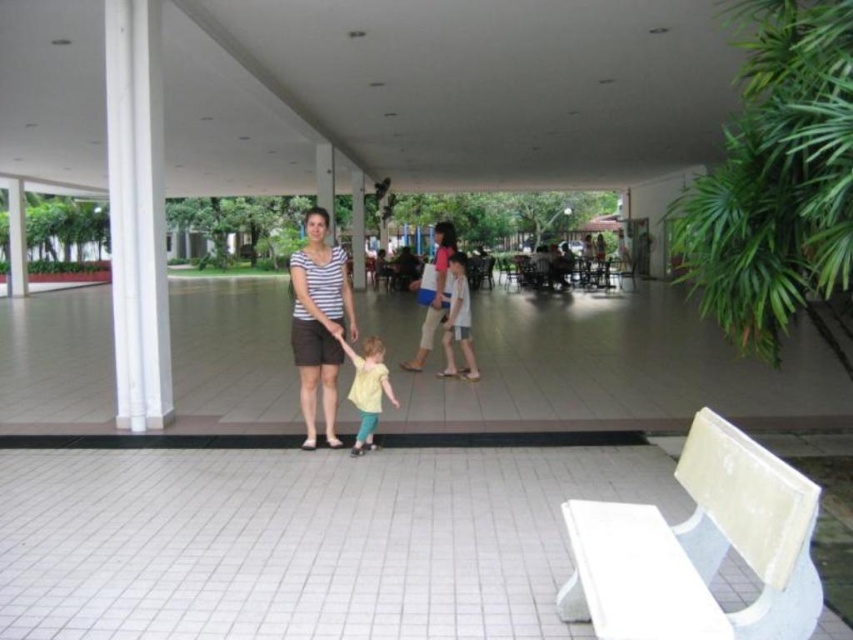
You are a photographer setting up for an event in the described area. You need to ensure that the yellow matte shirt at center and the light blue denim shorts at center are both visible in your shot. Given their sizes, which object should you focus on first to ensure proper framing?

The yellow matte shirt at center is smaller than the light blue denim shorts at center, so you should focus on the yellow matte shirt at center first to ensure it is properly framed, as smaller objects may require closer attention to detail for visibility.

You are designing a new clothing line and want to ensure that the striped cotton shirt at center and the yellow matte shirt at center can be displayed side by side in a store window. Given that the store window has a display space that is exactly the width of the wider of the two shirts, will both shirts fit without overlapping?

The striped cotton shirt at center is wider than the yellow matte shirt at center. Since the display space is exactly the width of the wider shirt, both shirts can fit side by side as long as they are placed next to each other without overlapping, as the total width required would be the sum of both shirts. However, if the display space is only as wide as the wider shirt alone, then only one shirt can fit at a time.

Looking at this image, you are a photographer standing in front of the white bench at the foreground. You want to take a photo of the striped cotton shirt at center and the yellow matte shirt at center so that both are clearly visible. Which shirt should you focus on to ensure the taller one is in focus?

The striped cotton shirt at center is taller than the yellow matte shirt at center, so you should focus on the striped cotton shirt at center to ensure the taller one is in focus.